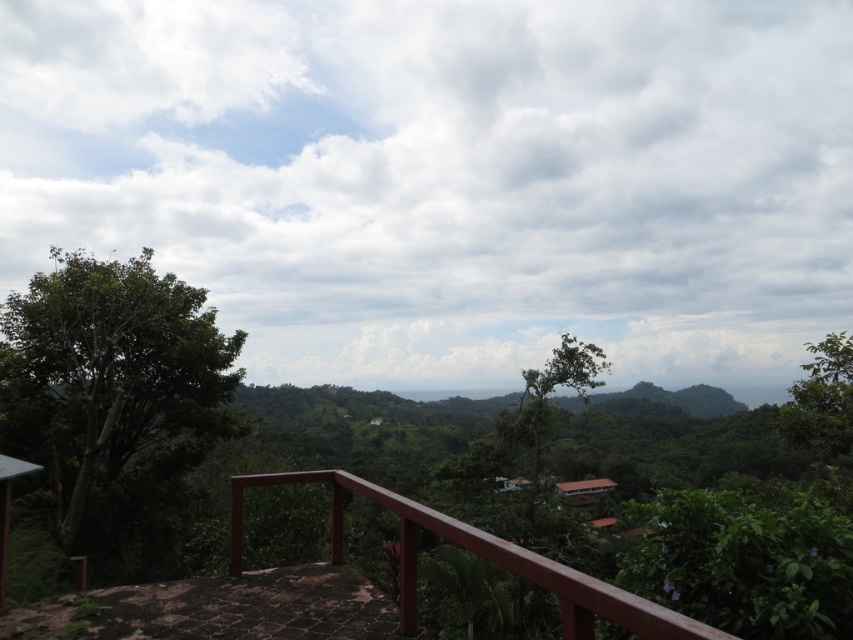
You are standing on the balcony and want to determine which green leafy tree is closer to you. Based on their heights, can you tell which one is nearer between the green leafy tree at left and the green leafy tree at right?

The green leafy tree at left is taller than the green leafy tree at right. In perspective, closer objects appear larger, so the taller tree at left is actually farther away, making the shorter green leafy tree at right closer to you.

In the scene shown: You are standing on the balcony and want to take a photo of both the green leafy tree at left and the green leafy tree at right. Which tree should you position yourself closer to in order to include both in the frame?

You should position yourself closer to the green leafy tree at left because it is to the left of the green leafy tree at right, allowing you to frame both trees by adjusting your angle to capture their positions.